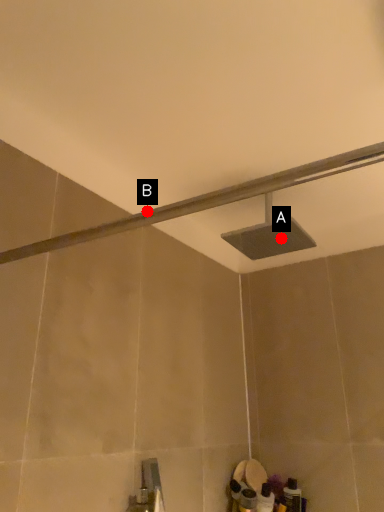
Question: Two points are circled on the image, labeled by A and B beside each circle. Which point is closer to the camera?

Choices:
 (A) A is closer
 (B) B is closer

Answer: (A)